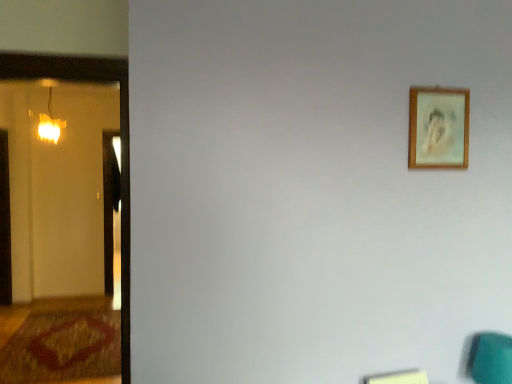
I want to click on vacant space in matte glass lamp at left (from a real-world perspective), so (54, 361).